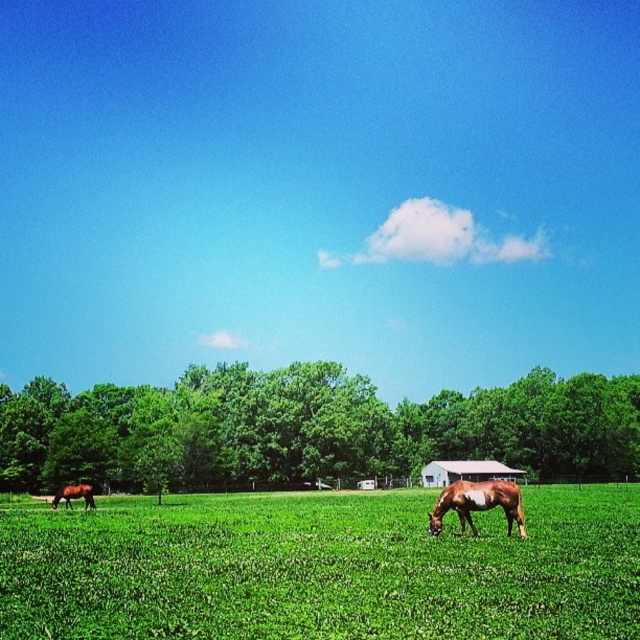
You are a farmer planning to place a new fence around the green grass pasture at center and the brown speckled horse at center. Based on their widths, which one requires a wider fence area?

The green grass pasture at center requires a wider fence area since its width surpasses that of the brown speckled horse at center.

You are a photographer standing in the green grass pasture at center. You want to take a photo of the brown speckled horse at center. Which direction should you move to frame the horse in your shot?

The green grass pasture at center is positioned on the left side of brown speckled horse at center. To frame the horse in your shot, you should move to the right side of the pasture.

You are a farmer checking the layout of your farm. You see the green grass pasture at center and the white wooden barn at center. Which object is located to the left of the other?

The green grass pasture at center is positioned on the left side of white wooden barn at center.